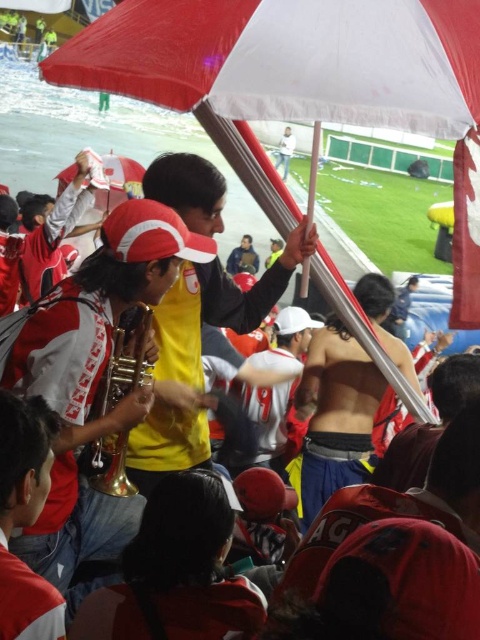
You are standing in the crowd at the soccer match and notice two points in the image, one at point (166, 436) and another at point (294, 145). Which point is closer to you?

Point (166, 436) is closer to the viewer than point (294, 145).

You are at the soccer match and want to take a photo of the white matte shirt at upper center without the red and white fabric umbrella at center blocking the view. Is the umbrella shorter than the shirt?

The red and white fabric umbrella at center is shorter than white matte shirt at upper center, so the umbrella will not block the view of the shirt.